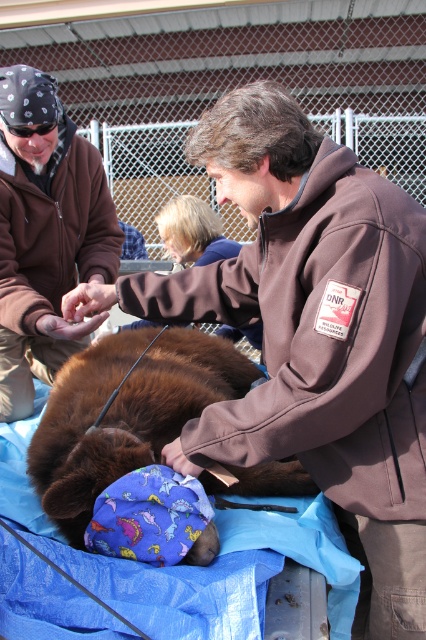
Which is more to the right, brown suede jacket at upper left or black rubber goggles at upper left?

Positioned to the right is brown suede jacket at upper left.

Who is more forward, (x=8, y=387) or (x=22, y=128)?

Positioned in front is point (x=22, y=128).

Measure the distance between point (60, 358) and camera.

They are 3.25 meters apart.

At what (x,y) coordinates should I click in order to perform the action: click on brown suede jacket at upper left. Please return your answer as a coordinate pair (x, y). Looking at the image, I should click on (46, 236).

Is point (40, 477) in front of point (17, 132)?

Yes.

Between brown furry bear at center and black rubber goggles at upper left, which one appears on the right side from the viewer's perspective?

brown furry bear at center is more to the right.

Locate an element on the screen. brown furry bear at center is located at coordinates (124, 412).

Image resolution: width=426 pixels, height=640 pixels. What are the coordinates of `brown furry bear at center` in the screenshot? It's located at (124, 412).

Where is `brown suede jacket at upper left`? This screenshot has width=426, height=640. brown suede jacket at upper left is located at coordinates (46, 236).

The height and width of the screenshot is (640, 426). In order to click on brown suede jacket at upper left in this screenshot , I will do `click(46, 236)`.